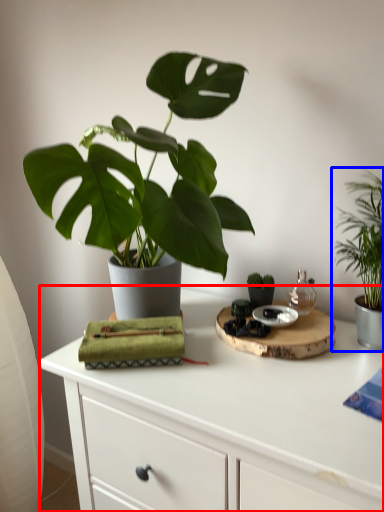
Question: Which object is closer to the camera taking this photo, table (highlighted by a red box) or houseplant (highlighted by a blue box)?

Choices:
 (A) table
 (B) houseplant

Answer: (A)